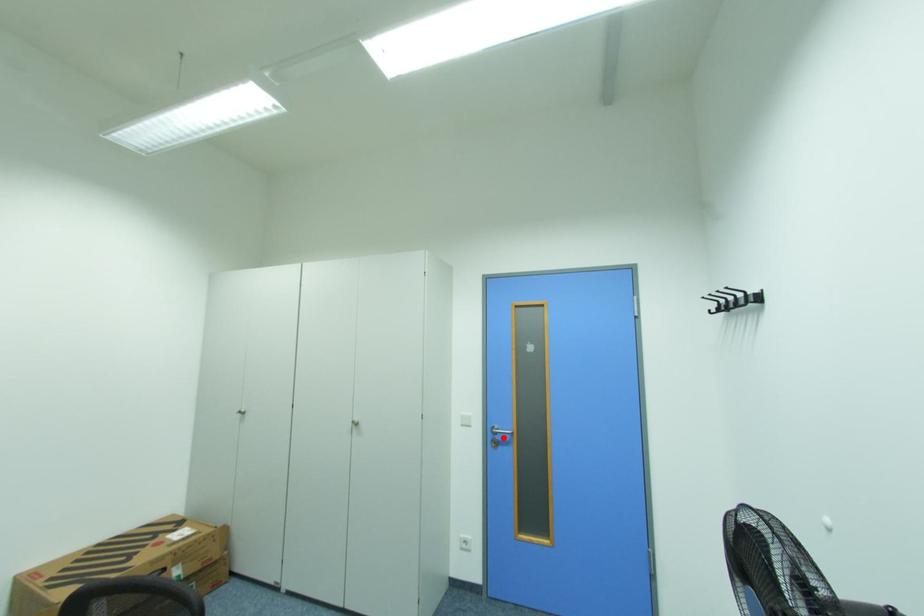
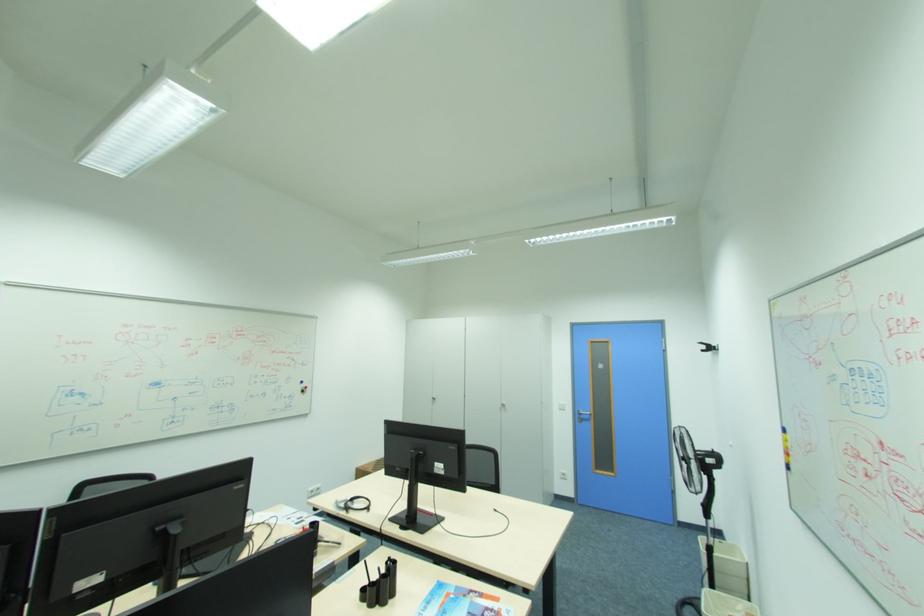
Find the pixel in the second image that matches the highlighted location in the first image.

(588, 416)